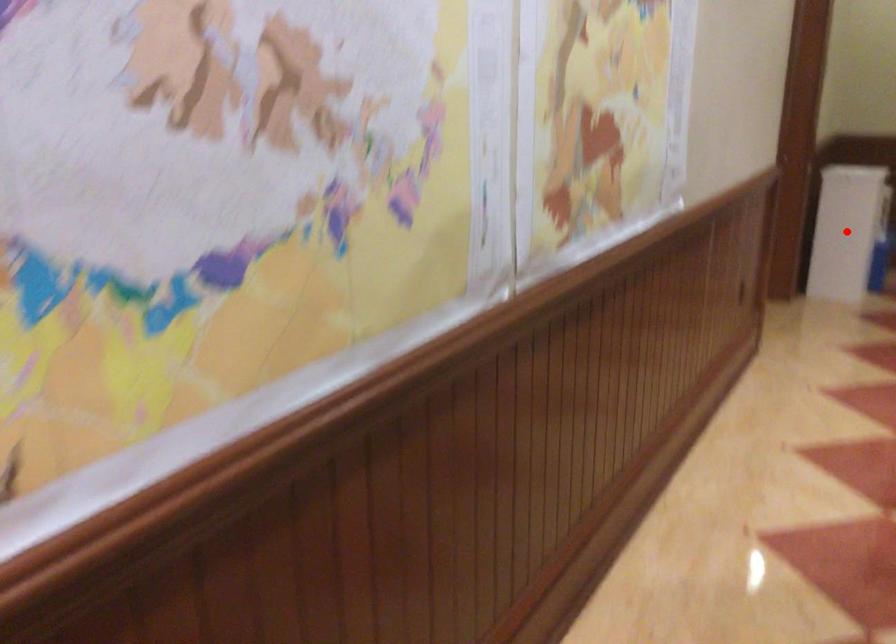
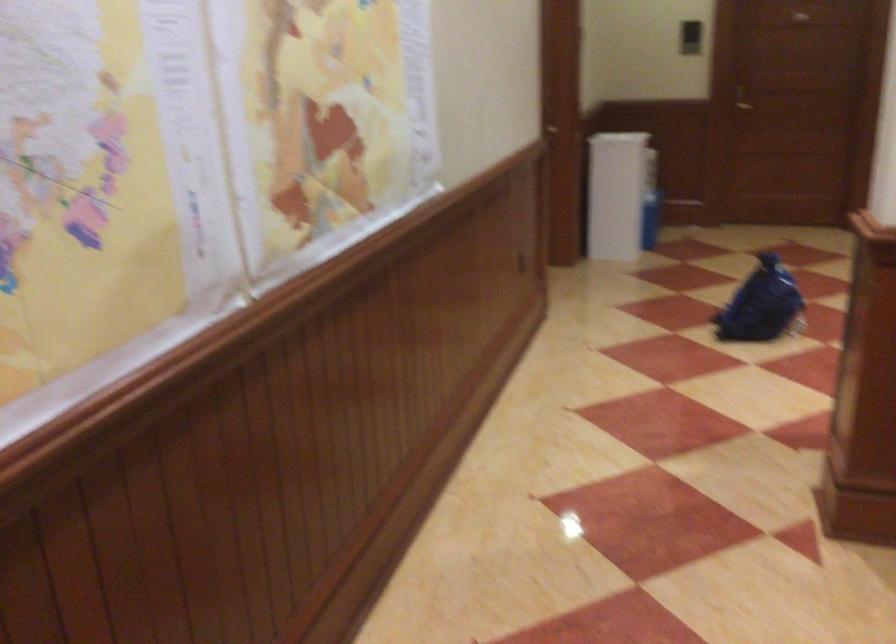
Find the pixel in the second image that matches the highlighted location in the first image.

(608, 211)